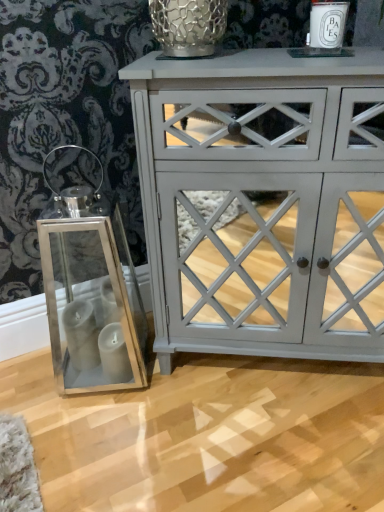
Describe the element at coordinates (265, 206) in the screenshot. I see `matte gray cabinet at center` at that location.

Describe the element at coordinates (327, 24) in the screenshot. I see `white ceramic candle at upper right` at that location.

Where is `matte gray cabinet at center`? The height and width of the screenshot is (512, 384). matte gray cabinet at center is located at coordinates (265, 206).

Does metallic mesh glass vase at upper center have a larger size compared to matte gray cabinet at center?

Incorrect, metallic mesh glass vase at upper center is not larger than matte gray cabinet at center.

Between metallic mesh glass vase at upper center and matte gray cabinet at center, which one appears on the left side from the viewer's perspective?

Positioned to the left is metallic mesh glass vase at upper center.

From the image's perspective, who appears lower, metallic mesh glass vase at upper center or matte gray cabinet at center?

matte gray cabinet at center appears lower in the image.

Considering their positions, is metallic mesh glass vase at upper center located in front of or behind matte gray cabinet at center?

metallic mesh glass vase at upper center is behind matte gray cabinet at center.

From a real-world perspective, which object rests below the other?

matte gray cabinet at center is physically lower.

From the image's perspective, is matte gray cabinet at center above or below metallic mesh glass vase at upper center?

Clearly, from the image's perspective, matte gray cabinet at center is below metallic mesh glass vase at upper center.

Does point (179, 325) come behind point (185, 38)?

Yes, it is behind point (185, 38).

Is matte gray cabinet at center next to metallic mesh glass vase at upper center and touching it?

There is a gap between matte gray cabinet at center and metallic mesh glass vase at upper center.

Which is behind, white ceramic candle at upper right or metallic mesh glass vase at upper center?

metallic mesh glass vase at upper center.

Between white ceramic candle at upper right and metallic mesh glass vase at upper center, which one has smaller width?

With smaller width is white ceramic candle at upper right.

Does white ceramic candle at upper right turn towards metallic mesh glass vase at upper center?

No, white ceramic candle at upper right does not turn towards metallic mesh glass vase at upper center.

Where is `candle holder located above the matte gray cabinet at center (from a real-world perspective)`? The height and width of the screenshot is (512, 384). candle holder located above the matte gray cabinet at center (from a real-world perspective) is located at coordinates (327, 24).

Consider the image. Can you confirm if matte gray cabinet at center is smaller than white ceramic candle at upper right?

No, matte gray cabinet at center is not smaller than white ceramic candle at upper right.

Is matte gray cabinet at center facing away from white ceramic candle at upper right?

No, white ceramic candle at upper right is not at the back of matte gray cabinet at center.

In the scene shown: From a real-world perspective, is matte gray cabinet at center on top of white ceramic candle at upper right?

No.

Choose the correct answer: Is metallic mesh glass vase at upper center inside white ceramic candle at upper right or outside it?

The correct answer is: outside.

Is metallic mesh glass vase at upper center positioned with its back to white ceramic candle at upper right?

No, white ceramic candle at upper right is not at the back of metallic mesh glass vase at upper center.

From a real-world perspective, is metallic mesh glass vase at upper center positioned above or below white ceramic candle at upper right?

Clearly, from a real-world perspective, metallic mesh glass vase at upper center is above white ceramic candle at upper right.

Can you confirm if white ceramic candle at upper right is smaller than matte gray cabinet at center?

Correct, white ceramic candle at upper right occupies less space than matte gray cabinet at center.

From the image's perspective, is white ceramic candle at upper right above matte gray cabinet at center?

Yes.

How different are the orientations of white ceramic candle at upper right and matte gray cabinet at center in degrees?

3.15 degrees.

Based on the photo, considering the relative positions of white ceramic candle at upper right and matte gray cabinet at center in the image provided, is white ceramic candle at upper right to the left or to the right of matte gray cabinet at center?

From the image, it's evident that white ceramic candle at upper right is to the right of matte gray cabinet at center.

Find the location of a particular element. The height and width of the screenshot is (512, 384). chest of drawers that appears on the right of metallic mesh glass vase at upper center is located at coordinates (265, 206).

I want to click on the chest of drawers in front of the metallic mesh glass vase at upper center, so click(265, 206).

Based on their spatial positions, is metallic mesh glass vase at upper center or matte gray cabinet at center further from white ceramic candle at upper right?

matte gray cabinet at center lies further to white ceramic candle at upper right than the other object.

Based on their spatial positions, is white ceramic candle at upper right or metallic mesh glass vase at upper center closer to matte gray cabinet at center?

metallic mesh glass vase at upper center is positioned closer to the anchor matte gray cabinet at center.

Which object lies nearer to the anchor point white ceramic candle at upper right, matte gray cabinet at center or metallic mesh glass vase at upper center?

Among the two, metallic mesh glass vase at upper center is located nearer to white ceramic candle at upper right.

Which object lies further to the anchor point metallic mesh glass vase at upper center, matte gray cabinet at center or white ceramic candle at upper right?

matte gray cabinet at center.

Considering their positions, is white ceramic candle at upper right positioned closer to metallic mesh glass vase at upper center than matte gray cabinet at center?

white ceramic candle at upper right is positioned closer to the anchor metallic mesh glass vase at upper center.

Based on the photo, considering their positions, is metallic mesh glass vase at upper center positioned further to matte gray cabinet at center than white ceramic candle at upper right?

white ceramic candle at upper right lies further to matte gray cabinet at center than the other object.

The width and height of the screenshot is (384, 512). I want to click on candle holder between metallic mesh glass vase at upper center and matte gray cabinet at center in the vertical direction, so click(x=327, y=24).